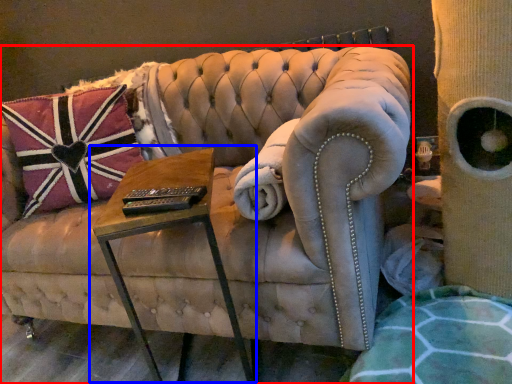
Question: Which object is closer to the camera taking this photo, furniture (highlighted by a red box) or table (highlighted by a blue box)?

Choices:
 (A) furniture
 (B) table

Answer: (A)